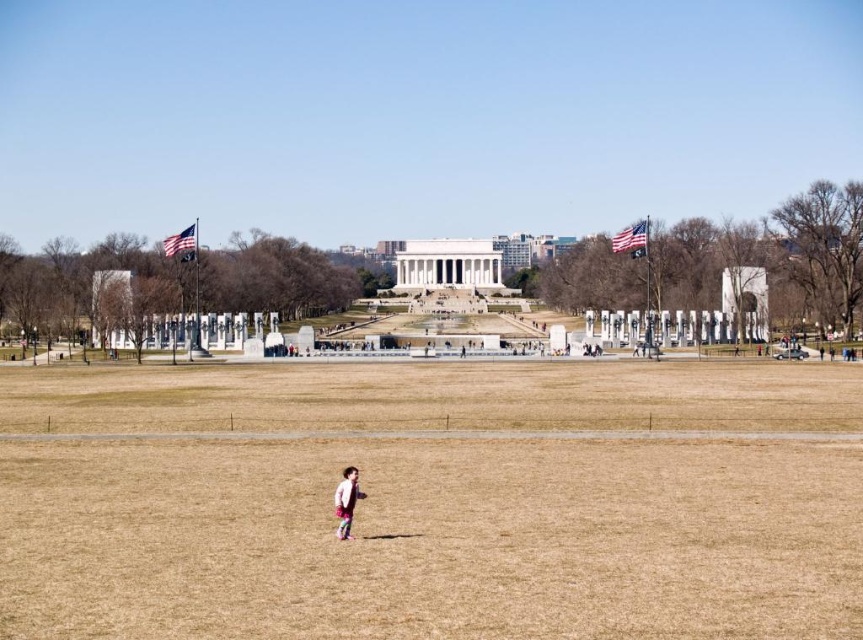
Question: Which point is farther to the camera?

Choices:
 (A) brown grass at center
 (B) pink fabric child at center

Answer: (B)

Question: Among these points, which one is farthest from the camera?

Choices:
 (A) (843, 476)
 (B) (341, 492)

Answer: (A)

Question: Can you confirm if brown grass at center is positioned to the right of pink fabric child at center?

Choices:
 (A) no
 (B) yes

Answer: (B)

Question: Does brown grass at center have a larger size compared to pink fabric child at center?

Choices:
 (A) yes
 (B) no

Answer: (A)

Question: Does brown grass at center appear on the left side of pink fabric child at center?

Choices:
 (A) yes
 (B) no

Answer: (B)

Question: Which object is farther from the camera taking this photo?

Choices:
 (A) brown grass at center
 (B) pink fabric child at center

Answer: (B)